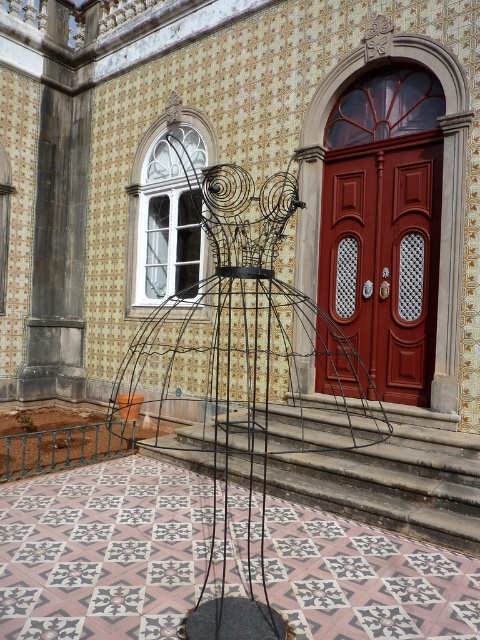
You are standing at the entrance of the building and notice the black wire sculpture at center and the matte red door at center. Which object is closer to you?

The black wire sculpture at center is closer to you because it is further to the viewer than the matte red door at center.

You are standing at the entrance of the building and want to locate both the black wire sculpture at center and the matte red door at center. According to the scene description, which object is positioned to the left of the other?

The black wire sculpture at center is to the left of the matte red door at center.